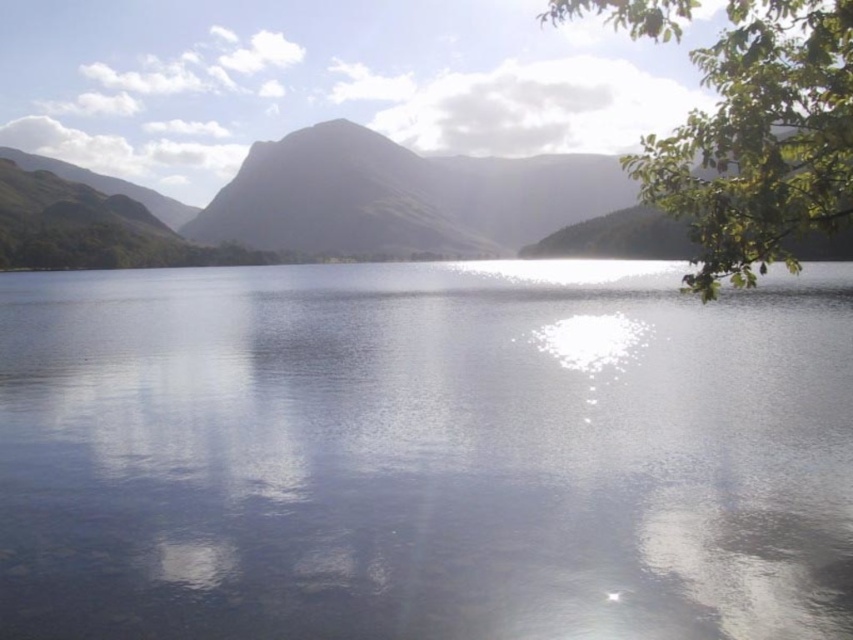
You are standing on a boat in the middle of the lake and see the clear water at center and the green matte mountain at center. Which object is located to the left of the other?

The clear water at center is positioned on the right side of green matte mountain at center, so the green matte mountain at center is to the left of the clear water at center.

You are an artist sketching this landscape. You want to ensure the clear water at center and the green leafy branch at upper right are proportionally accurate. Which object should you draw first to maintain the correct size relationship?

You should draw the green leafy branch at upper right first because it is larger than the clear water at center. Since it is bigger, starting with the larger object ensures you allocate enough space for the smaller clear water at center.